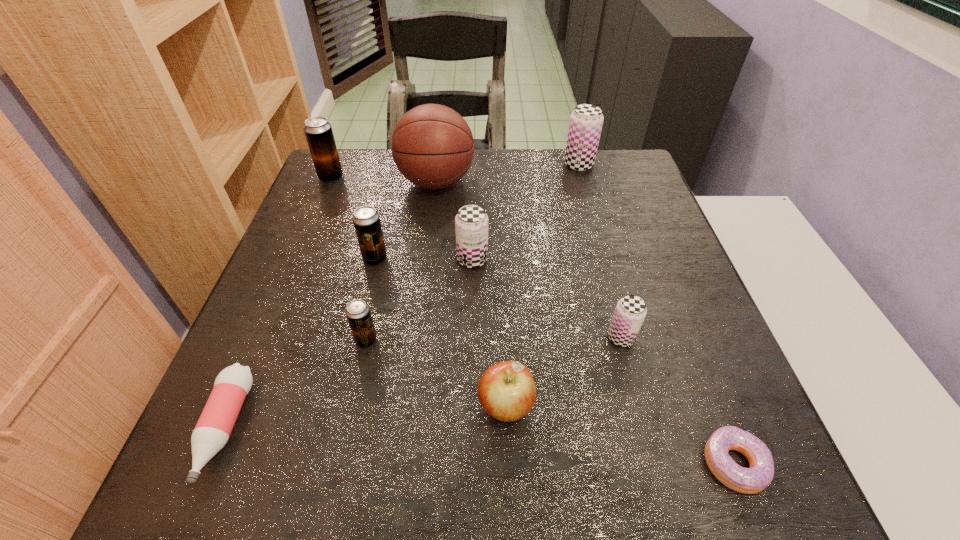
I want to click on object that is at the near left corner, so click(x=212, y=431).

At what (x,y) coordinates should I click in order to perform the action: click on object at the far right corner. Please return your answer as a coordinate pair (x, y). Looking at the image, I should click on (586, 121).

You are a GUI agent. You are given a task and a screenshot of the screen. Output one action in this format:
    pyautogui.click(x=<x>, y=<y>)
    Task: Click on the object that is at the near right corner
    The width and height of the screenshot is (960, 540).
    Given the screenshot: What is the action you would take?
    pyautogui.click(x=751, y=480)

What are the coordinates of `free region at the far edge` in the screenshot? It's located at point(544,151).

Locate an element on the screen. free region at the near edge of the desktop is located at coordinates (330, 489).

You are a GUI agent. You are given a task and a screenshot of the screen. Output one action in this format:
    pyautogui.click(x=<x>, y=<y>)
    Task: Click on the free spot at the left edge of the desktop
    This screenshot has height=540, width=960.
    Given the screenshot: What is the action you would take?
    pyautogui.click(x=267, y=360)

The height and width of the screenshot is (540, 960). I want to click on vacant space at the right edge, so pyautogui.click(x=725, y=367).

Find the location of a particular element. The width and height of the screenshot is (960, 540). blank space at the far left corner is located at coordinates (376, 168).

Find the location of a particular element. This screenshot has height=540, width=960. vacant position at the near left corner of the desktop is located at coordinates (261, 469).

You are a GUI agent. You are given a task and a screenshot of the screen. Output one action in this format:
    pyautogui.click(x=<x>, y=<y>)
    Task: Click on the vacant space at the far right corner of the desktop
    
    Given the screenshot: What is the action you would take?
    pyautogui.click(x=624, y=189)